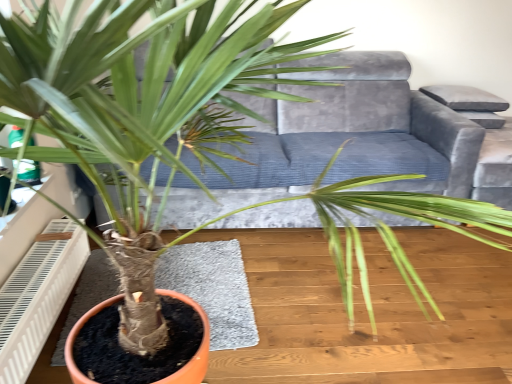
Question: From their relative heights in the image, would you say velvet grey armchair at upper right is taller or shorter than velvet grey couch at center?

Choices:
 (A) short
 (B) tall

Answer: (A)

Question: Considering their positions, is velvet grey armchair at upper right located in front of or behind velvet grey couch at center?

Choices:
 (A) front
 (B) behind

Answer: (B)

Question: Which object is positioned farthest from the velvet grey couch at center?

Choices:
 (A) white plastic air conditioner at lower left
 (B) velvet grey armchair at upper right

Answer: (A)

Question: Based on their relative distances, which object is farther from the white plastic air conditioner at lower left?

Choices:
 (A) velvet grey couch at center
 (B) velvet grey armchair at upper right

Answer: (B)